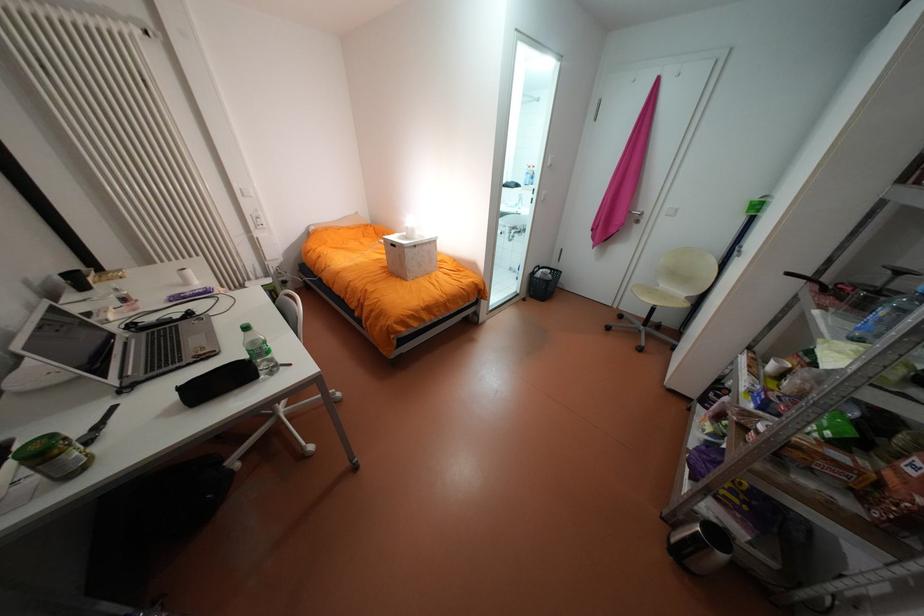
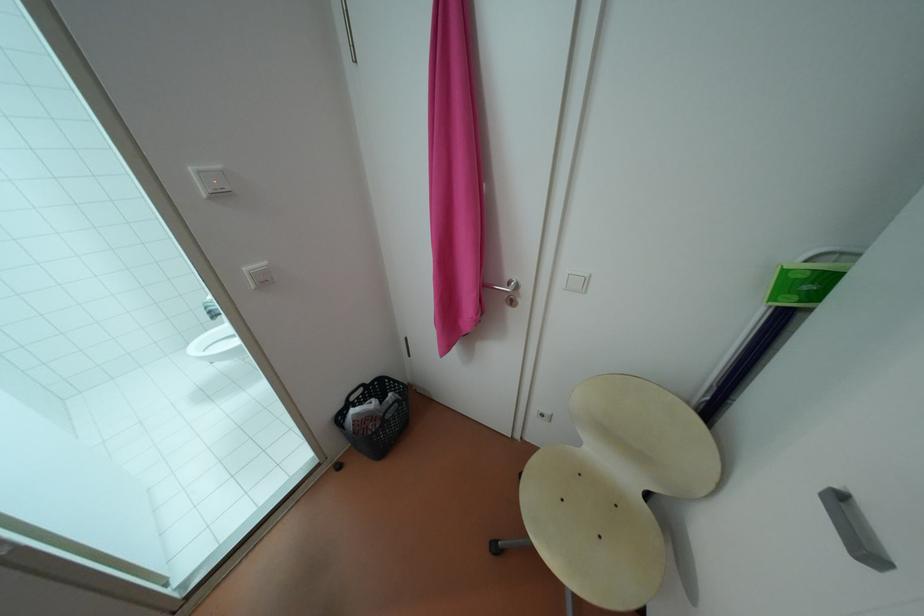
What movement of the cameraman would produce the second image?

The movement direction of the cameraman is right, forward.